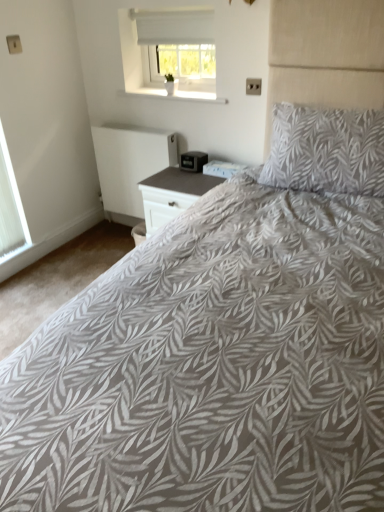
Question: Does point (302, 146) appear closer or farther from the camera than point (173, 73)?

Choices:
 (A) farther
 (B) closer

Answer: (B)

Question: From their relative heights in the image, would you say gray leaf-patterned pillow at upper right is taller or shorter than white matte window at upper center, which is the first window from top to bottom?

Choices:
 (A) tall
 (B) short

Answer: (A)

Question: Which of these objects is positioned farthest from the white textured window at left, the 2th window from the top?

Choices:
 (A) white matte radiator at lower left
 (B) gray leaf-patterned pillow at upper right
 (C) white matte window at upper center, the second window viewed from the left

Answer: (B)

Question: Estimate the real-world distances between objects in this image. Which object is farther from the white textured window at left, which is the 1th window in bottom-to-top order?

Choices:
 (A) white matte radiator at lower left
 (B) gray leaf-patterned pillow at upper right
 (C) white matte window at upper center, which is counted as the second window, starting from the bottom

Answer: (B)